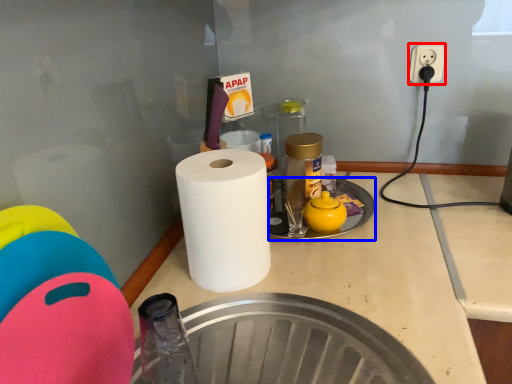
Question: Which point is further to the camera, electric outlet (highlighted by a red box) or manhole (highlighted by a blue box)?

Choices:
 (A) electric outlet
 (B) manhole

Answer: (A)